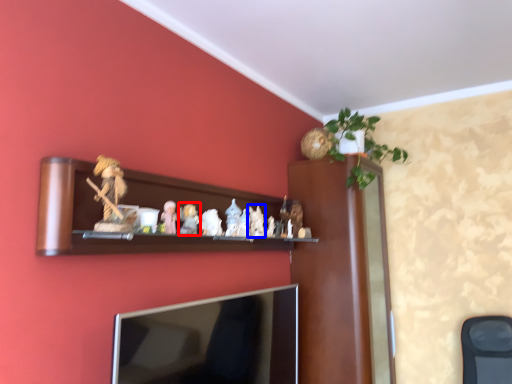
Question: Which of the following is the closest to the observer, toy (highlighted by a red box) or toy (highlighted by a blue box)?

Choices:
 (A) toy
 (B) toy

Answer: (A)